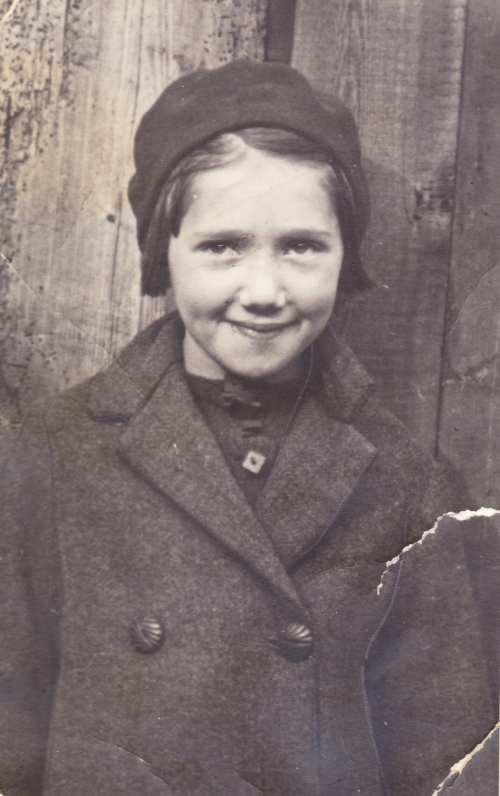
The image size is (500, 796). Find the location of `coat`. coat is located at coordinates (135, 567).